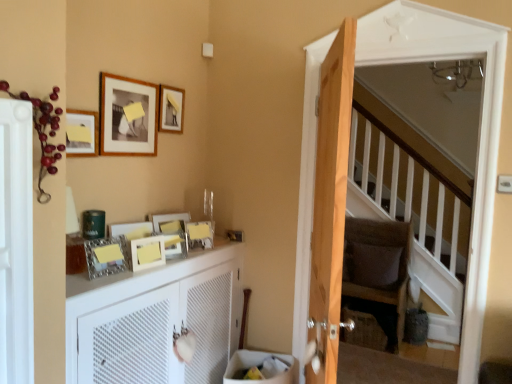
Question: Is dark brown fabric armchair at center oriented away from matte silver picture frame at center, the 2th picture frame in the bottom-to-top sequence?

Choices:
 (A) no
 (B) yes

Answer: (A)

Question: Is dark brown fabric armchair at center located outside matte silver picture frame at center, the 2th picture frame in the bottom-to-top sequence?

Choices:
 (A) yes
 (B) no

Answer: (A)

Question: Is dark brown fabric armchair at center at the right side of matte silver picture frame at center, the 2th picture frame in the bottom-to-top sequence?

Choices:
 (A) yes
 (B) no

Answer: (A)

Question: Can you confirm if dark brown fabric armchair at center is shorter than matte silver picture frame at center, the 2th picture frame in the bottom-to-top sequence?

Choices:
 (A) yes
 (B) no

Answer: (B)

Question: Is dark brown fabric armchair at center not close to matte silver picture frame at center, the 2th picture frame in the bottom-to-top sequence?

Choices:
 (A) no
 (B) yes

Answer: (B)

Question: Is matte wooden picture frame at upper left, which appears as the 7th picture frame when ordered from the bottom, bigger or smaller than wooden screen door at right, placed as the first screen door when sorted from back to front?

Choices:
 (A) small
 (B) big

Answer: (A)

Question: From the image's perspective, relative to wooden screen door at right, placed as the first screen door when sorted from back to front, is matte wooden picture frame at upper left, which appears as the 7th picture frame when ordered from the bottom, above or below?

Choices:
 (A) above
 (B) below

Answer: (A)

Question: From a real-world perspective, relative to wooden screen door at right, the 2th screen door from the left, is matte wooden picture frame at upper left, which appears as the 7th picture frame when ordered from the bottom, vertically above or below?

Choices:
 (A) below
 (B) above

Answer: (B)

Question: Considering their positions, is matte wooden picture frame at upper left, the second picture frame from the top, located in front of or behind wooden screen door at right, placed as the first screen door when sorted from back to front?

Choices:
 (A) behind
 (B) front

Answer: (A)

Question: Considering the positions of wooden photo frame at center, the 8th picture frame from the top, and light brown wooden door at center in the image, is wooden photo frame at center, the 8th picture frame from the top, wider or thinner than light brown wooden door at center?

Choices:
 (A) thin
 (B) wide

Answer: (A)

Question: In terms of height, does wooden photo frame at center, which appears as the first picture frame when ordered from the bottom, look taller or shorter compared to light brown wooden door at center?

Choices:
 (A) short
 (B) tall

Answer: (A)

Question: Considering the relative positions of wooden photo frame at center, the 8th picture frame from the top, and light brown wooden door at center in the image provided, is wooden photo frame at center, the 8th picture frame from the top, to the left or to the right of light brown wooden door at center?

Choices:
 (A) right
 (B) left

Answer: (B)

Question: Is point (150, 259) closer or farther from the camera than point (327, 269)?

Choices:
 (A) closer
 (B) farther

Answer: (B)

Question: In terms of size, does matte wooden picture frame at upper left, the second picture frame from the top, appear bigger or smaller than matte wooden picture frame at upper left, which is the third picture frame in top-to-bottom order?

Choices:
 (A) big
 (B) small

Answer: (A)

Question: Considering the positions of point (108, 89) and point (76, 112), is point (108, 89) closer or farther from the camera than point (76, 112)?

Choices:
 (A) farther
 (B) closer

Answer: (A)